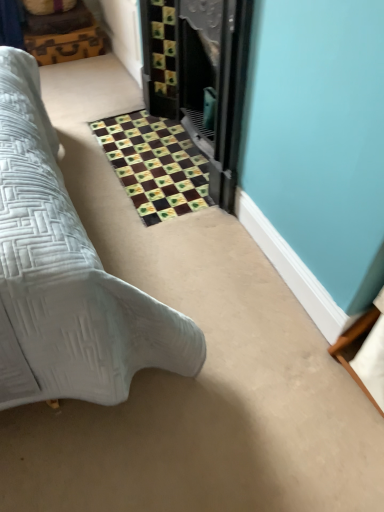
Image resolution: width=384 pixels, height=512 pixels. What are the coordinates of `empty space that is ontop of patchwork rug at center (from a real-world perspective)` in the screenshot? It's located at (155, 157).